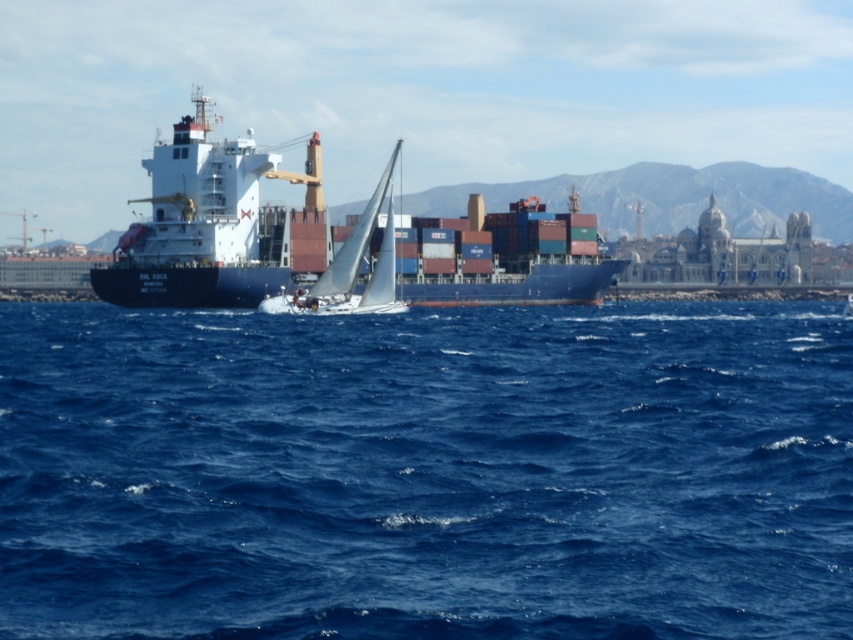
You are an observer on the deck of the cargo ship RHL AQUA. You notice the blue water at center and the white sailboat at center. Which object takes up more space in your view?

The blue water at center takes up more space in your view because it has a larger size compared to the white sailboat at center.